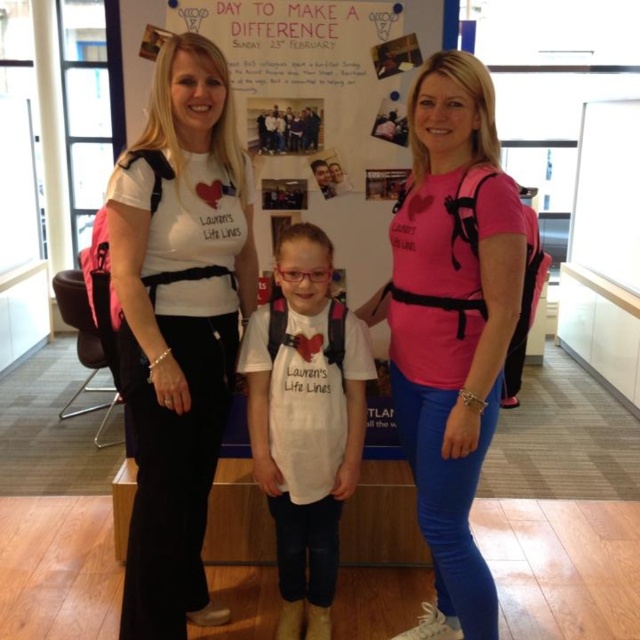
From the picture: Measure the distance between pink matte t-shirt at center and camera.

1.70 meters

Is point (422, 344) farther from camera compared to point (304, 250)?

No, (422, 344) is in front of (304, 250).

Who is more distant from viewer, (x=467, y=180) or (x=317, y=352)?

The point (x=317, y=352) is behind.

I want to click on pink matte t-shirt at center, so click(451, 324).

Is point (234, 314) less distant than point (385, 292)?

Yes, it is in front of point (385, 292).

Is white matte t-shirt at center wider than pink matte t-shirt at center?

No, white matte t-shirt at center is not wider than pink matte t-shirt at center.

Is point (198, 556) closer to camera compared to point (454, 340)?

No.

At what (x,y) coordinates should I click in order to perform the action: click on white matte t-shirt at center. Please return your answer as a coordinate pair (x, y). The width and height of the screenshot is (640, 640). Looking at the image, I should click on (179, 324).

Does white matte t-shirt at center come in front of white matte shirt at center?

Yes, it is.

What do you see at coordinates (179, 324) in the screenshot? I see `white matte t-shirt at center` at bounding box center [179, 324].

Is point (118, 225) positioned in front of point (296, 628)?

Yes, point (118, 225) is in front of point (296, 628).

Identify the location of white matte t-shirt at center. The height and width of the screenshot is (640, 640). (179, 324).